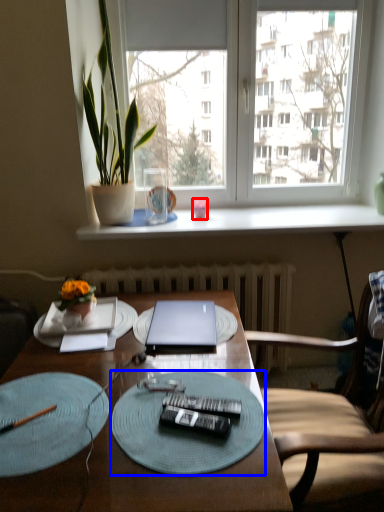
Question: Which object is closer to the camera taking this photo, coffee cup (highlighted by a red box) or glass plate (highlighted by a blue box)?

Choices:
 (A) coffee cup
 (B) glass plate

Answer: (B)